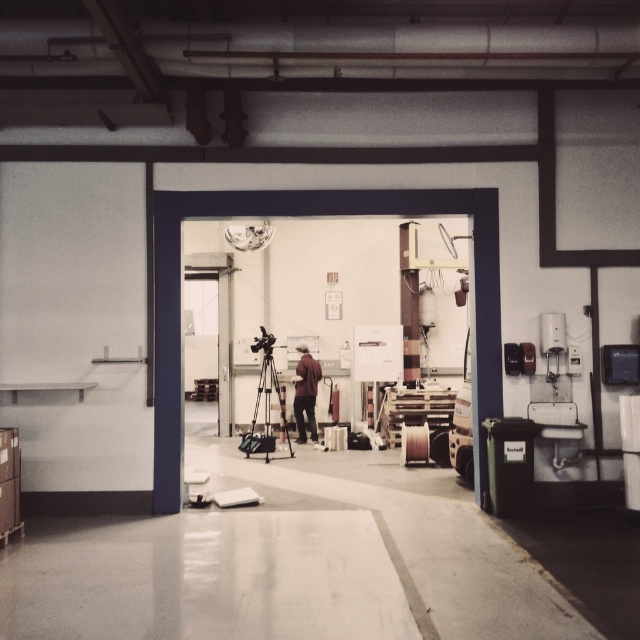
You are setting up a camera on the matte black tripod at center in the workshop. You need to ensure there is enough space between the tripod and the dark brown leather jacket at center. Given that the tripod is wider than the jacket, can you estimate if the jacket will fit in the space allocated for it?

The matte black tripod at center is wider than the dark brown leather jacket at center, so the jacket will fit in the space allocated as it is narrower than the tripod.

From the picture: You are a technician who needs to set up a camera on the matte black tripod at center. The dark brown leather jacket at center is in the way. What is the minimum distance you need to move the jacket to clear the space for the tripod?

The matte black tripod at center is 29.80 inches from the dark brown leather jacket at center. To clear the space, the jacket needs to be moved at least 29.80 inches away from the tripod.

You are standing in the workshop and need to determine the relative positions of two points marked in the scene. Which of the two points, point 1 at coordinates point (x=260, y=452) or point 2 at coordinates point (x=296, y=442), is closer to you?

Point 1 at coordinates point (x=260, y=452) is closer to the viewer than point 2 at coordinates point (x=296, y=442).